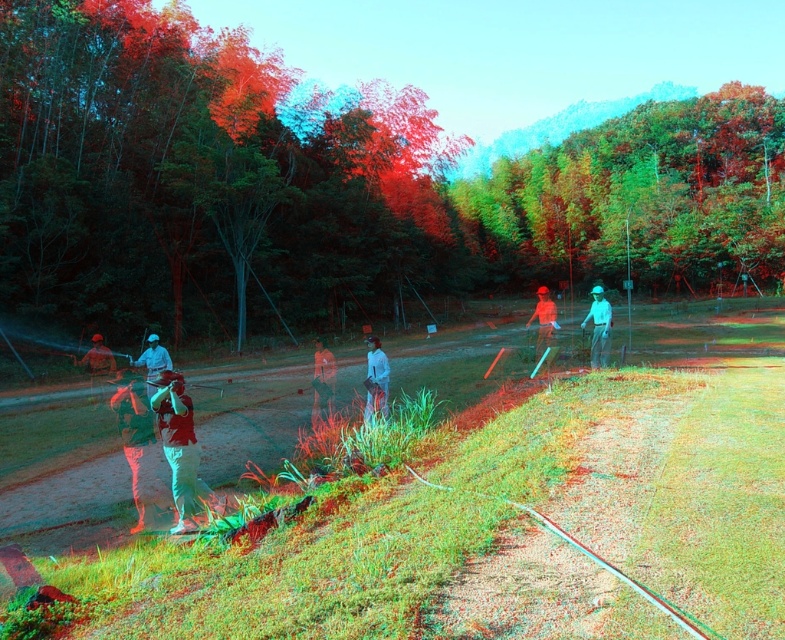
Based on the photo, you are a photographer trying to capture a photo of the light gray fabric shirt at center and the matte green shirt at left. Which shirt is covering part of the other one in the image?

The light gray fabric shirt at center is positioned over matte green shirt at left, so it is covering part of the matte green shirt at left.

From the picture: You are a photographer trying to capture a clear shot of the green grass at center without the green leafy tree at center blocking the view. From which side should you position yourself to take the photo?

To capture the green grass at center without the green leafy tree at center blocking the view, position yourself behind the green grass at center since it is located behind the tree.